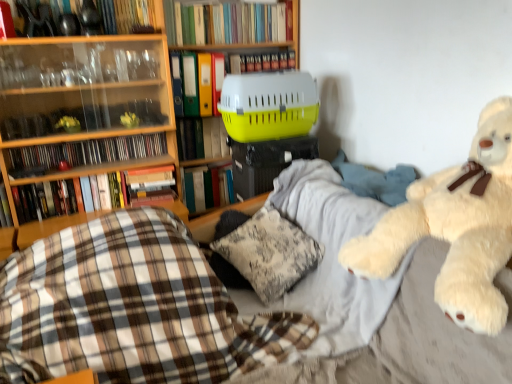
Question: Is hardcover book at left, which is the 2th book in bottom-to-top order, taller than yellow plastic pet carrier at center, positioned as the fifth book in bottom-to-top order?

Choices:
 (A) no
 (B) yes

Answer: (A)

Question: Is hardcover book at left, which is the 2th book in bottom-to-top order, wider than yellow plastic pet carrier at center, positioned as the fifth book in bottom-to-top order?

Choices:
 (A) yes
 (B) no

Answer: (A)

Question: Considering the relative sizes of hardcover book at left, placed as the 8th book when sorted from top to bottom, and yellow plastic pet carrier at center, which is counted as the fifth book, starting from the top, in the image provided, is hardcover book at left, placed as the 8th book when sorted from top to bottom, shorter than yellow plastic pet carrier at center, which is counted as the fifth book, starting from the top,?

Choices:
 (A) yes
 (B) no

Answer: (A)

Question: Is hardcover book at left, placed as the 8th book when sorted from top to bottom, positioned far away from yellow plastic pet carrier at center, which is counted as the fifth book, starting from the top?

Choices:
 (A) no
 (B) yes

Answer: (A)

Question: Is yellow plastic pet carrier at center, which is counted as the fifth book, starting from the top, at the back of hardcover book at left, which is the 2th book in bottom-to-top order?

Choices:
 (A) no
 (B) yes

Answer: (A)

Question: In the image, is yellow plastic file at center, marked as the sixth book in a bottom-to-top arrangement, positioned in front of or behind hardcover book at upper center, which appears as the 1th book when viewed from the top?

Choices:
 (A) front
 (B) behind

Answer: (A)

Question: Looking at their shapes, would you say yellow plastic file at center, placed as the fourth book when sorted from top to bottom, is wider or thinner than hardcover book at upper center, which appears as the 1th book when viewed from the top?

Choices:
 (A) wide
 (B) thin

Answer: (A)

Question: Choose the correct answer: Is yellow plastic file at center, placed as the fourth book when sorted from top to bottom, inside hardcover book at upper center, positioned as the ninth book in bottom-to-top order, or outside it?

Choices:
 (A) inside
 (B) outside

Answer: (B)

Question: From the image's perspective, relative to hardcover book at upper center, which appears as the 1th book when viewed from the top, is yellow plastic file at center, placed as the fourth book when sorted from top to bottom, above or below?

Choices:
 (A) above
 (B) below

Answer: (B)

Question: Based on their sizes in the image, would you say yellow plastic pet carrier at center, which is counted as the fifth book, starting from the top, is bigger or smaller than hardcover book at center, the seventh book from the top?

Choices:
 (A) small
 (B) big

Answer: (A)

Question: From a real-world perspective, is yellow plastic pet carrier at center, positioned as the fifth book in bottom-to-top order, above or below hardcover book at center, the seventh book from the top?

Choices:
 (A) below
 (B) above

Answer: (B)

Question: In terms of height, does yellow plastic pet carrier at center, which is counted as the fifth book, starting from the top, look taller or shorter compared to hardcover book at center, the 3th book ordered from the bottom?

Choices:
 (A) short
 (B) tall

Answer: (A)

Question: In the image, is yellow plastic pet carrier at center, positioned as the fifth book in bottom-to-top order, positioned in front of or behind hardcover book at center, the 3th book ordered from the bottom?

Choices:
 (A) front
 (B) behind

Answer: (A)

Question: In the image, is yellow plastic pet carrier at center, which is counted as the fifth book, starting from the top, positioned in front of or behind hardcover book at left, which is the 2th book in bottom-to-top order?

Choices:
 (A) front
 (B) behind

Answer: (B)

Question: From a real-world perspective, relative to hardcover book at left, which is the 2th book in bottom-to-top order, is yellow plastic pet carrier at center, positioned as the fifth book in bottom-to-top order, vertically above or below?

Choices:
 (A) above
 (B) below

Answer: (A)